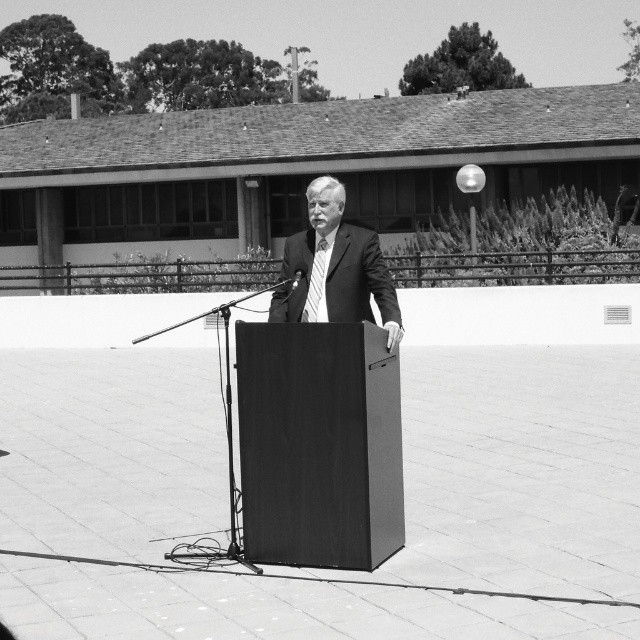
Does smooth black podium at center have a greater height compared to smooth suit at center?

Indeed, smooth black podium at center has a greater height compared to smooth suit at center.

Can you confirm if smooth black podium at center is positioned to the left of smooth suit at center?

Correct, you'll find smooth black podium at center to the left of smooth suit at center.

Measure the distance between smooth black podium at center and camera.

smooth black podium at center and camera are 25.48 feet apart from each other.

Image resolution: width=640 pixels, height=640 pixels. What are the coordinates of `smooth black podium at center` in the screenshot? It's located at (317, 444).